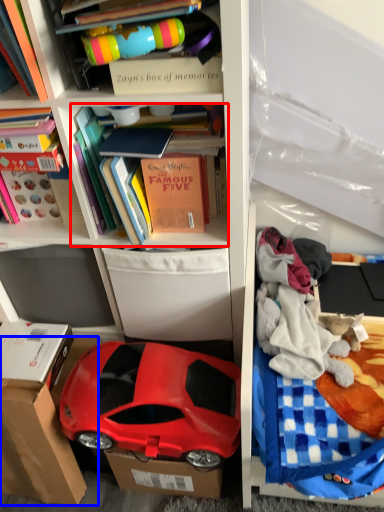
Question: Among these objects, which one is nearest to the camera, book (highlighted by a red box) or cardboard box (highlighted by a blue box)?

Choices:
 (A) book
 (B) cardboard box

Answer: (A)